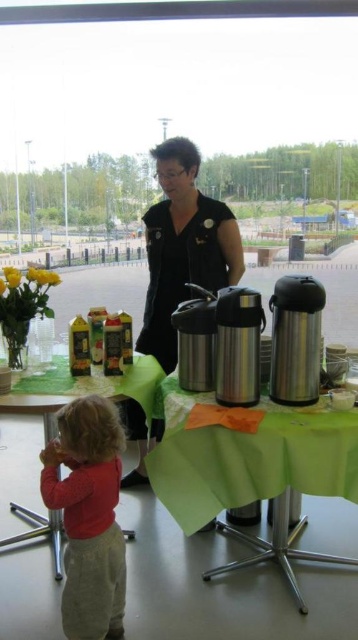
You are organizing a party and need to place a rectangular box that is 1.2 meters long on the green fabric table at lower left. Considering the matte red shirt at lower left is already on the table, can the box fit on the table without overlapping the shirt?

The matte red shirt at lower left is narrower than the green fabric table at lower left, so the box might fit if placed appropriately, but since the shirt is on the table, you need to ensure there is enough space around it. However, without knowing the exact dimensions of the shirt or the table beyond the shirt being narrower, it is uncertain if the 1.2m box will fit without overlapping.

What are the coordinates of the green fabric table at center?

The green fabric table at center is located at coordinates point (250, 465).